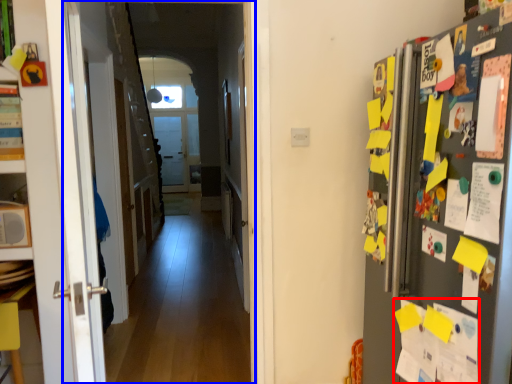
Question: Among these objects, which one is nearest to the camera, paper (highlighted by a red box) or corridor (highlighted by a blue box)?

Choices:
 (A) paper
 (B) corridor

Answer: (A)